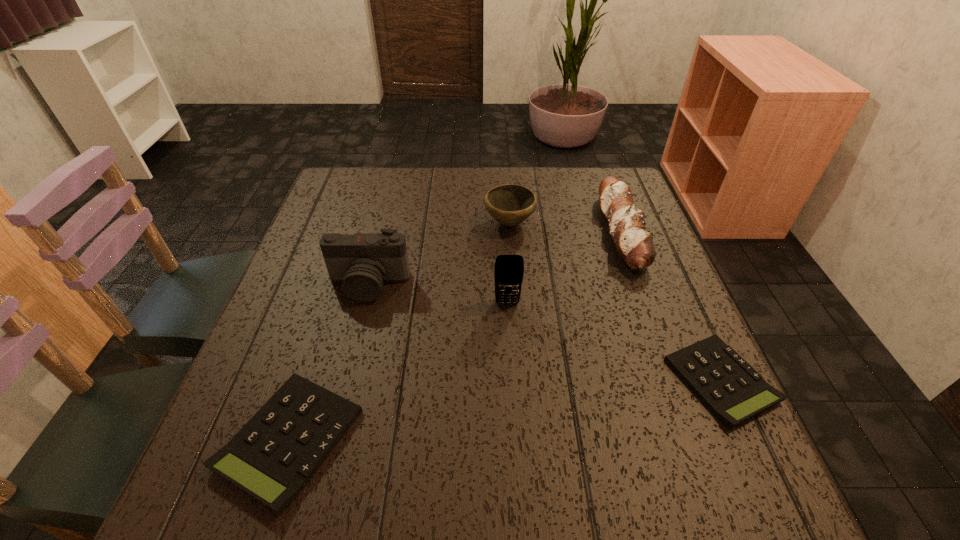
Locate an element on the screen. The image size is (960, 540). the left calculator is located at coordinates pyautogui.click(x=276, y=453).

Identify the location of the taller calculator. This screenshot has width=960, height=540. (276, 453).

The height and width of the screenshot is (540, 960). In order to click on the right calculator in this screenshot , I will do 730,387.

Image resolution: width=960 pixels, height=540 pixels. In order to click on the shortest object in this screenshot , I will do `click(730, 387)`.

This screenshot has width=960, height=540. Identify the location of bowl. (510, 204).

Locate an element on the screen. This screenshot has height=540, width=960. baguet is located at coordinates (626, 223).

This screenshot has height=540, width=960. Find the location of `camera`. camera is located at coordinates (362, 262).

At what (x,y) coordinates should I click in order to perform the action: click on cellular telephone. Please return your answer as a coordinate pair (x, y). Looking at the image, I should click on (509, 269).

At what (x,y) coordinates should I click in order to perform the action: click on vacant region located on the back of the taller calculator. Please return your answer as a coordinate pair (x, y). The height and width of the screenshot is (540, 960). Looking at the image, I should click on pos(329,317).

Identify the location of free region located on the back of the right calculator. (663, 254).